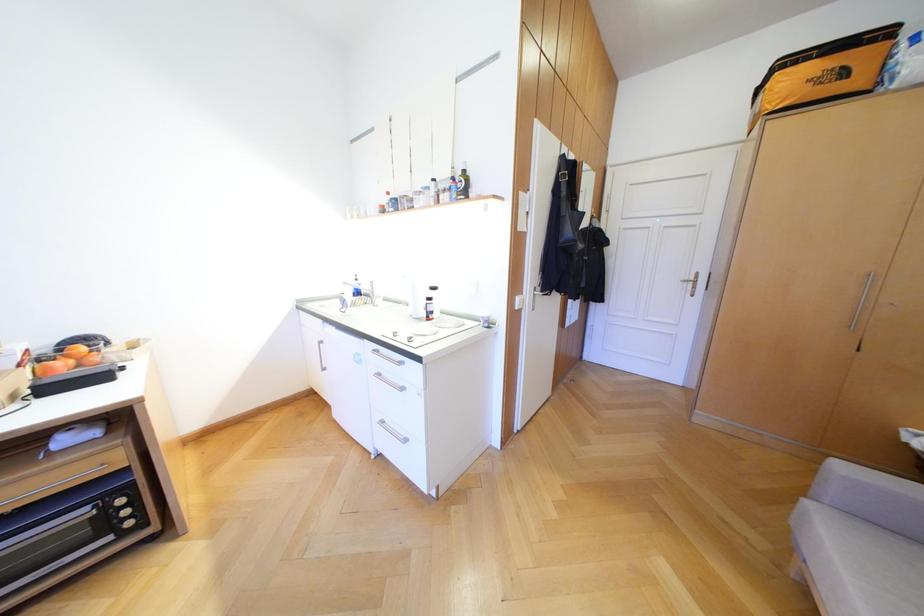
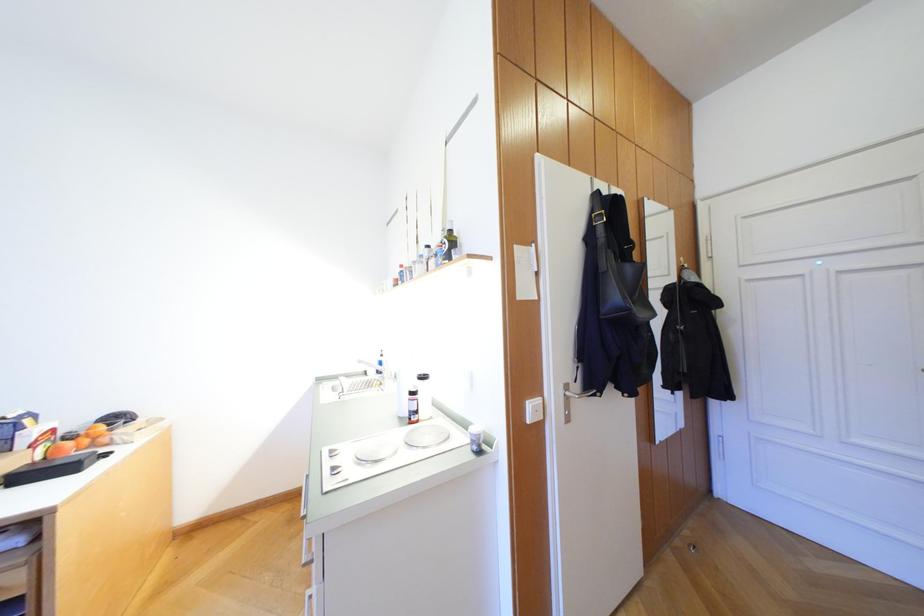
In a continuous first-person perspective shot, in which direction is the camera moving?

The cameraman moved toward right, forward.